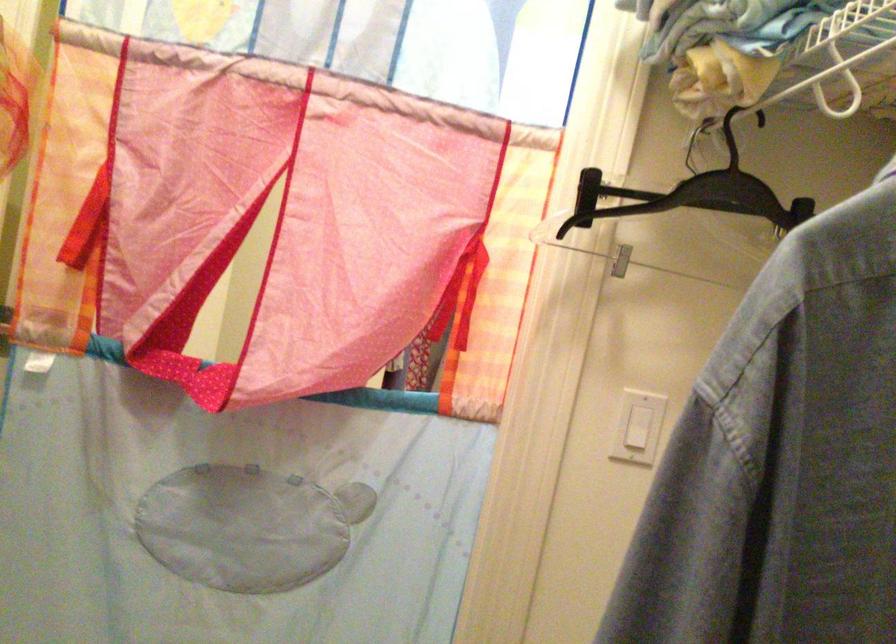
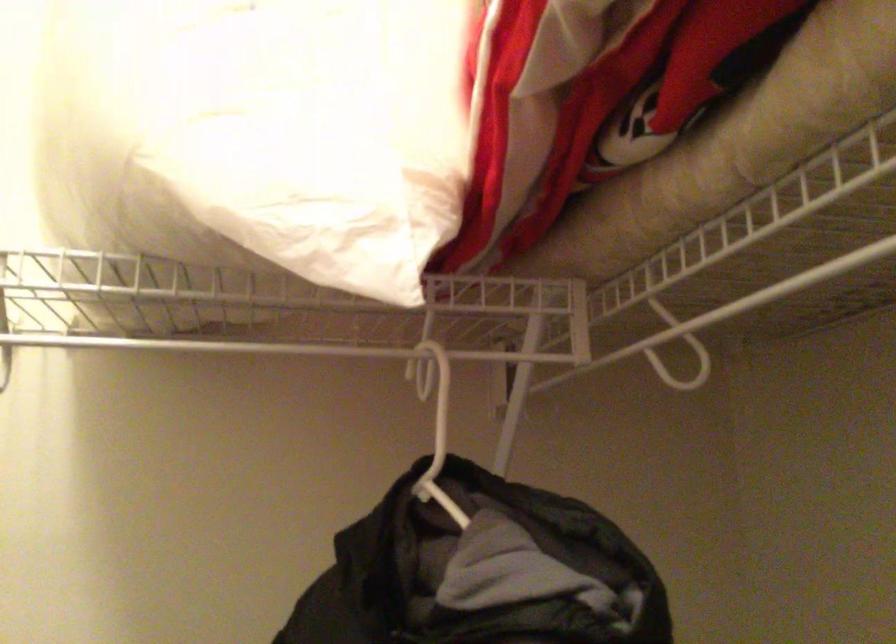
Question: The images are taken continuously from a first-person perspective. In which direction is your viewpoint rotating?

Choices:
 (A) Left
 (B) Right
 (C) Up
 (D) Down

Answer: (B)